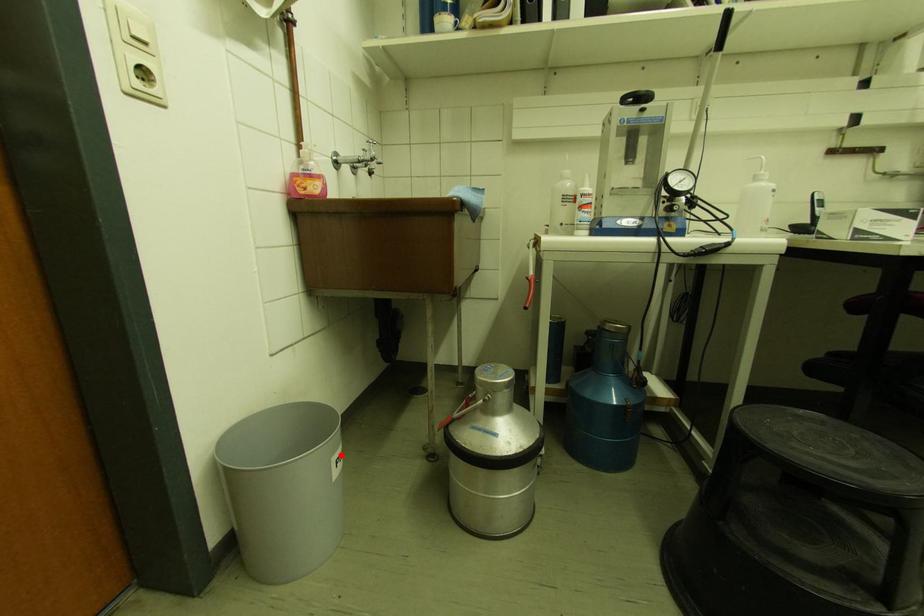
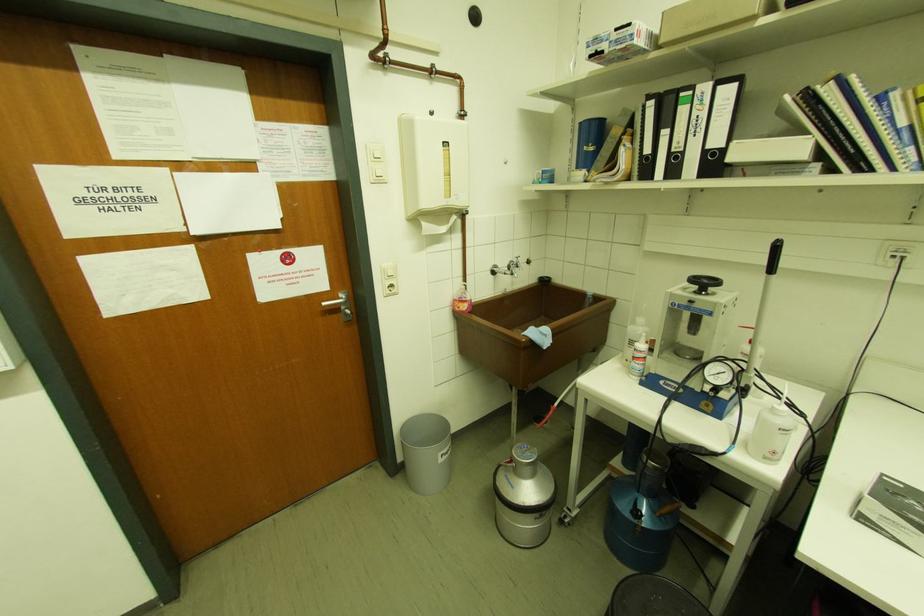
Find the pixel in the second image that matches the highlighted location in the first image.

(446, 453)